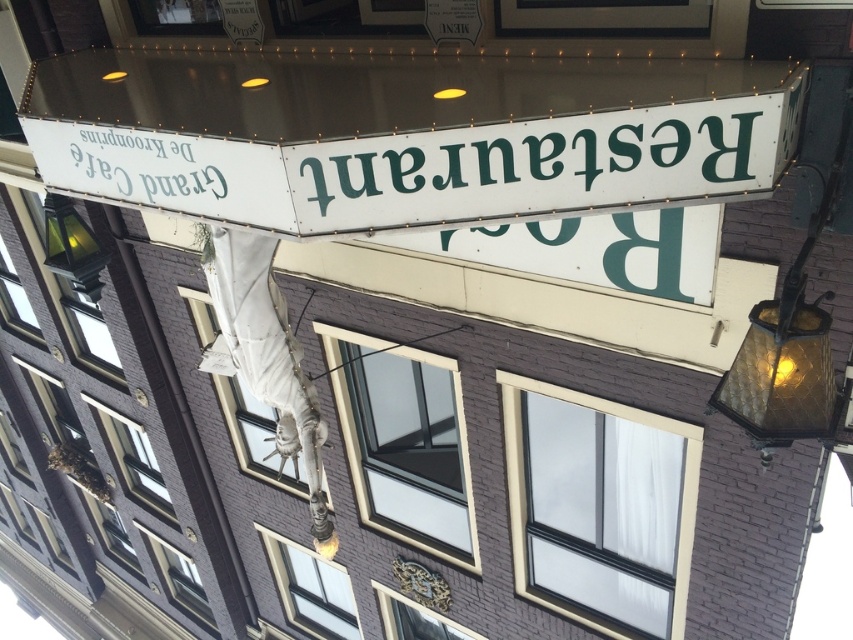
Question: Does white paper sign at upper left appear under matte glass lamp at left?

Choices:
 (A) no
 (B) yes

Answer: (A)

Question: Based on their relative distances, which object is farther from the matte glass lamp at left?

Choices:
 (A) greenmaterial/texture sign at upper center
 (B) amber glass lamp at right

Answer: (B)

Question: Is greenmaterial/texture sign at upper center wider than amber glass lamp at right?

Choices:
 (A) no
 (B) yes

Answer: (B)

Question: Which is nearer to the amber glass lamp at right?

Choices:
 (A) matte glass lamp at left
 (B) greenmaterial/texture sign at upper center

Answer: (B)

Question: Estimate the real-world distances between objects in this image. Which object is closer to the matte glass lamp at left?

Choices:
 (A) white paper sign at upper left
 (B) greenmaterial/texture sign at upper center

Answer: (A)

Question: Does amber glass lamp at right have a greater width compared to matte glass lamp at left?

Choices:
 (A) no
 (B) yes

Answer: (A)